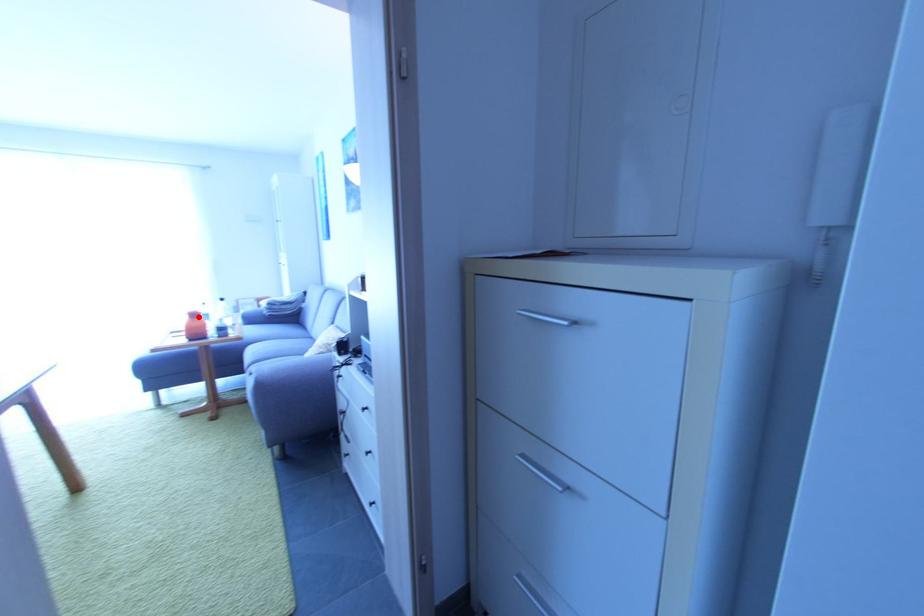
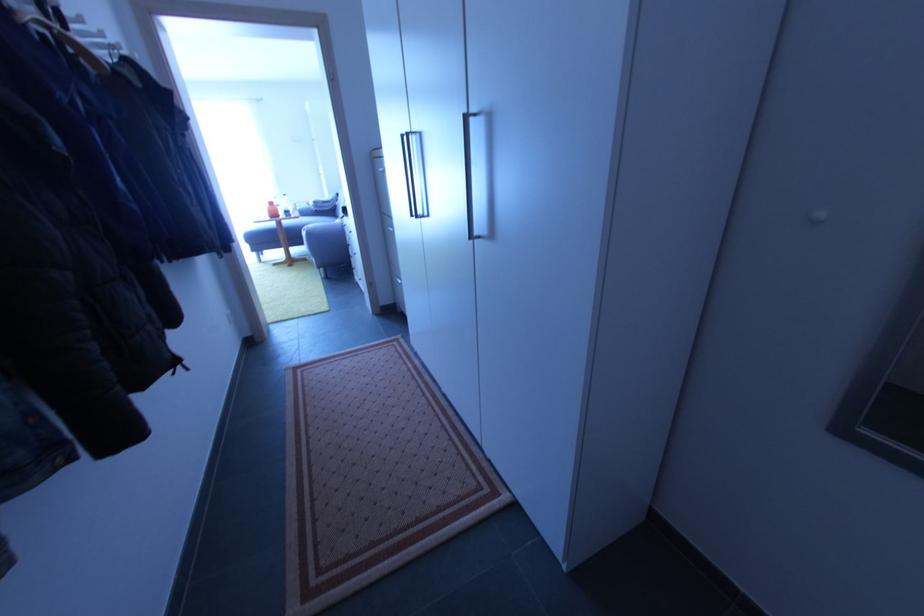
Locate, in the second image, the point that corresponds to the highlighted location in the first image.

(275, 205)